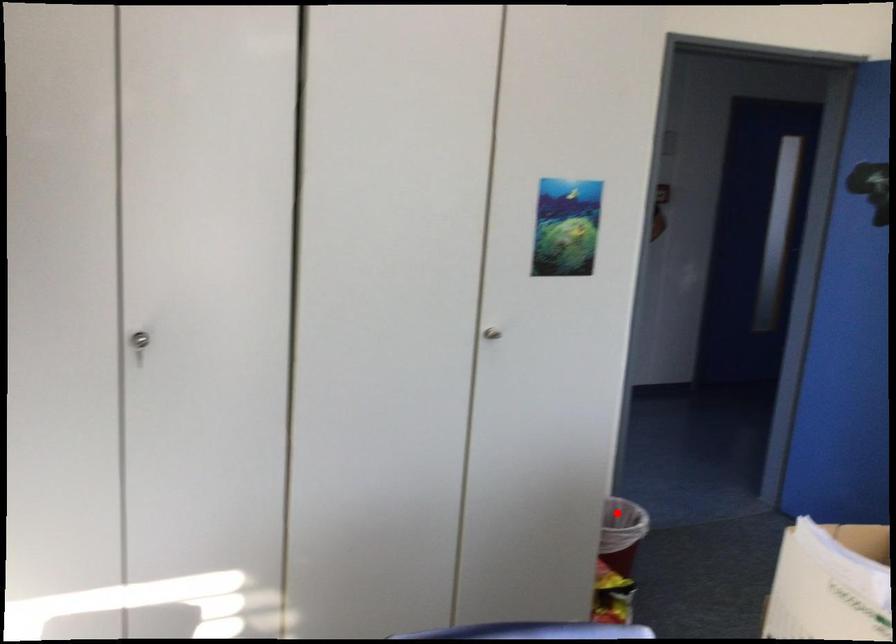
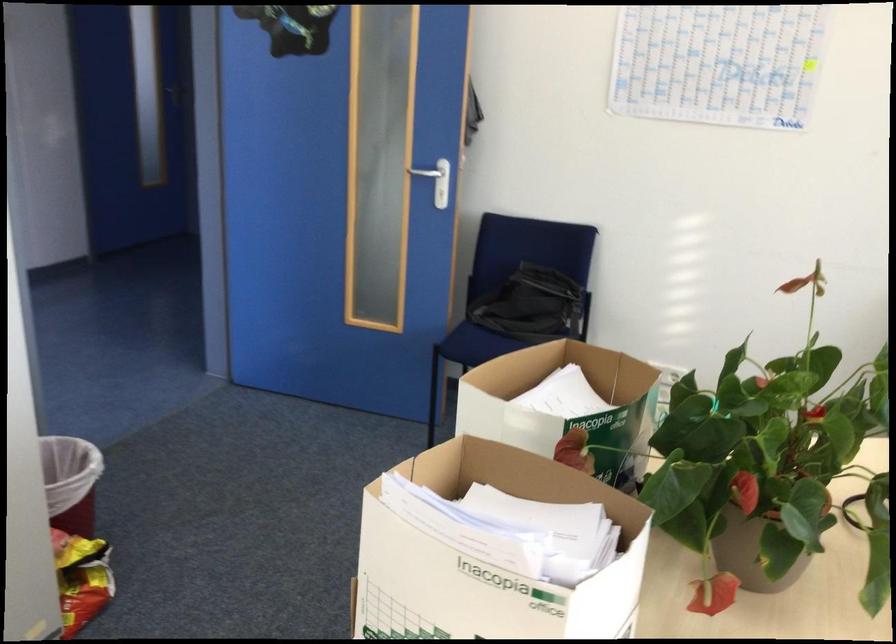
Locate, in the second image, the point that corresponds to the highlighted location in the first image.

(71, 482)